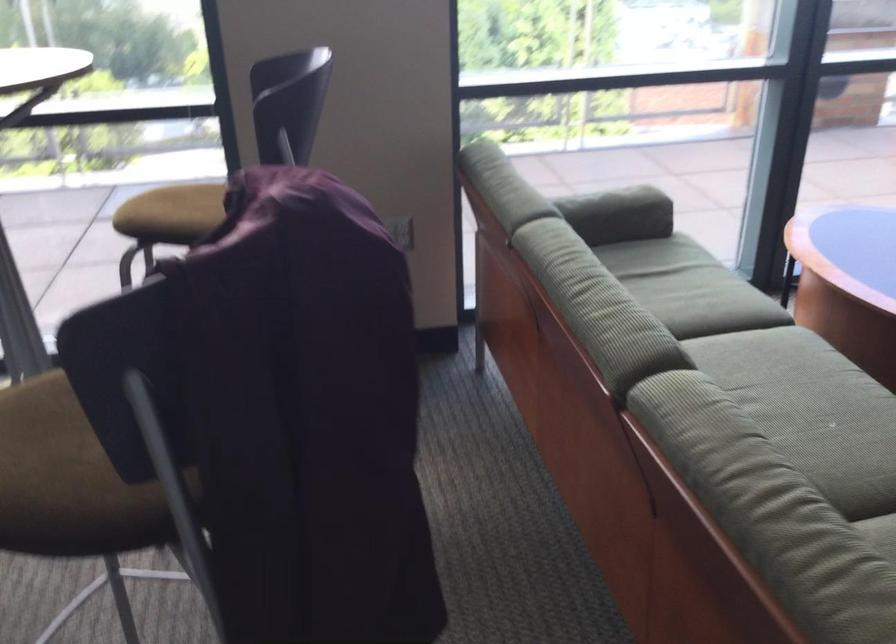
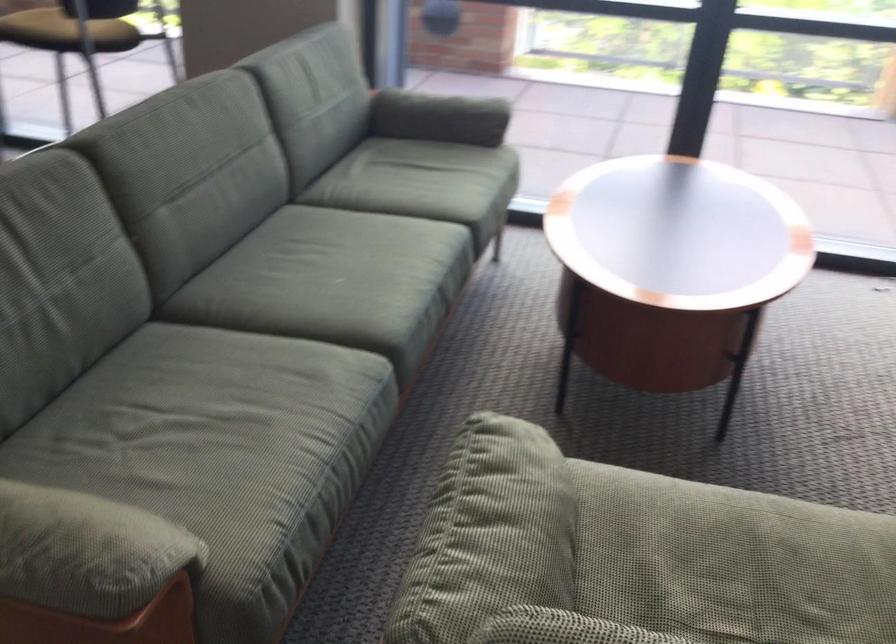
Question: The images are taken continuously from a first-person perspective. In which direction are you moving?

Choices:
 (A) Left
 (B) Right
 (C) Forward
 (D) Backward

Answer: (B)